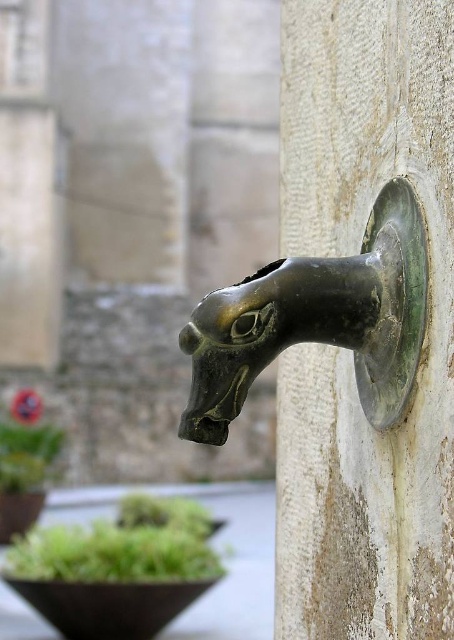
You are standing in front of the bronze water spout shaped like a horse head. You notice two points marked on the wall. One is at coordinate point (422, 24) and the other at point (325, 339). From your perspective, which point is closer to you?

Point (325, 339) is closer to you because it is in front of point (422, 24) according to their spatial arrangement.